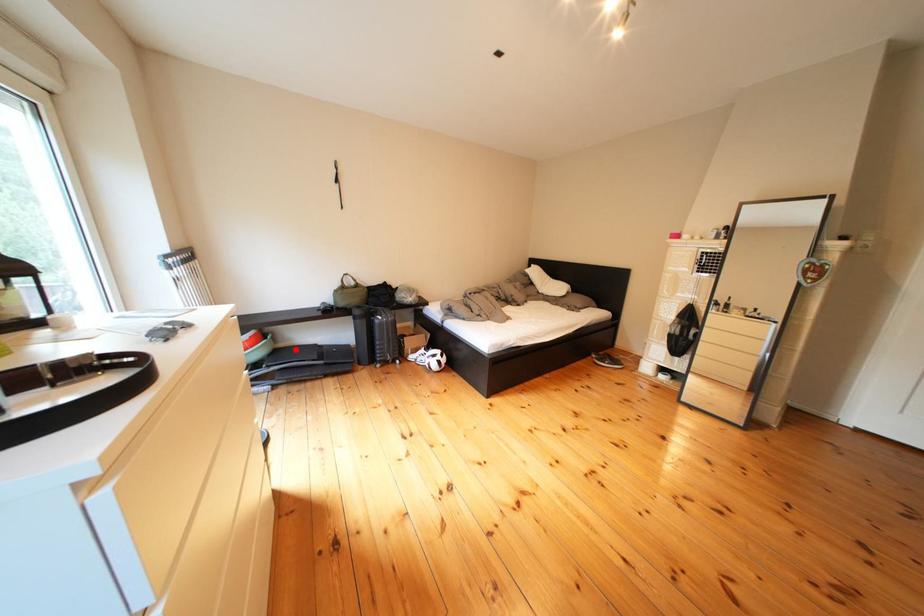
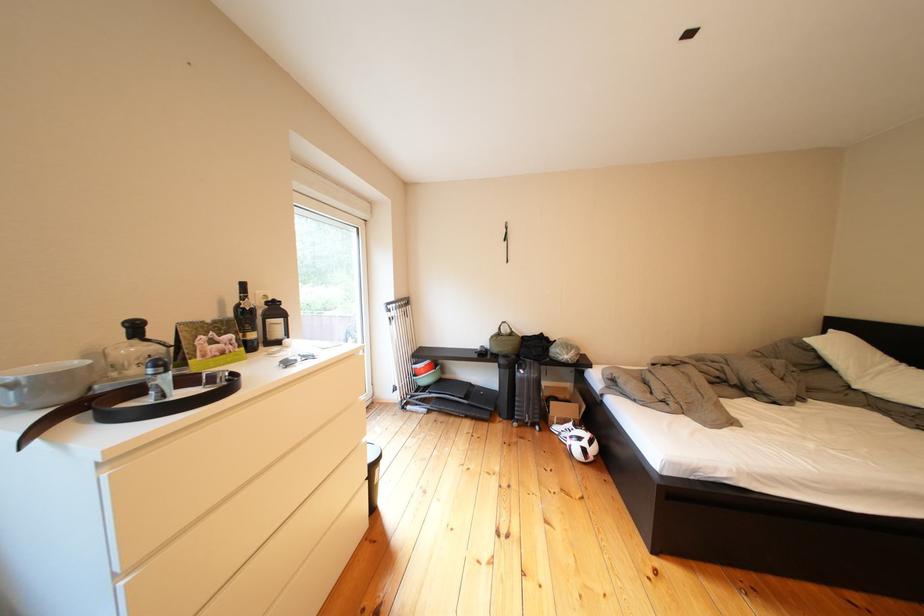
Find the pixel in the second image that matches the highlighted location in the first image.

(462, 381)